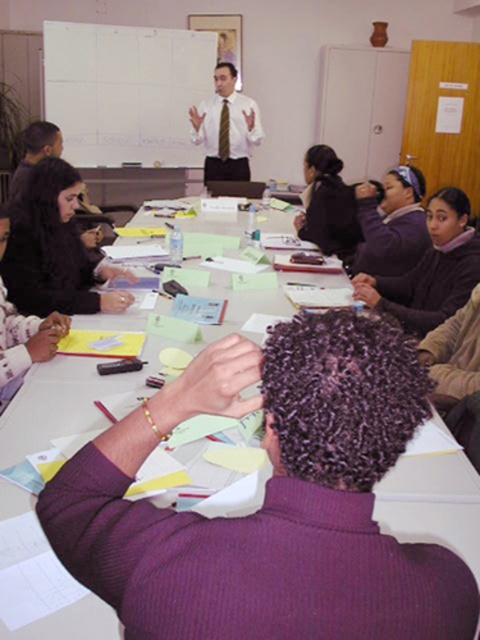
Is point (86, 253) less distant than point (350, 244)?

That is True.

Can you confirm if matte black sweater at lower left is shorter than black matte shirt at upper center?

Yes, matte black sweater at lower left is shorter than black matte shirt at upper center.

Find the location of a particular element. This screenshot has height=640, width=480. matte black sweater at lower left is located at coordinates (55, 250).

Locate an element on the screen. The width and height of the screenshot is (480, 640). matte black sweater at lower left is located at coordinates (55, 250).

Who is positioned more to the right, dark purple sweater at upper right or purple fleece jacket at upper center?

dark purple sweater at upper right is more to the right.

Is point (403, 292) closer to viewer compared to point (410, 193)?

Yes.

The width and height of the screenshot is (480, 640). I want to click on dark purple sweater at upper right, so click(431, 269).

The width and height of the screenshot is (480, 640). I want to click on white paper at center, so click(41, 580).

From the picture: Who is lower down, white paper at center or matte black sweater at lower left?

white paper at center is below.

Which is behind, point (216, 513) or point (57, 294)?

The point (57, 294) is behind.

At what (x,y) coordinates should I click in order to perform the action: click on white paper at center. Please return your answer as a coordinate pair (x, y). The height and width of the screenshot is (640, 480). Looking at the image, I should click on (41, 580).